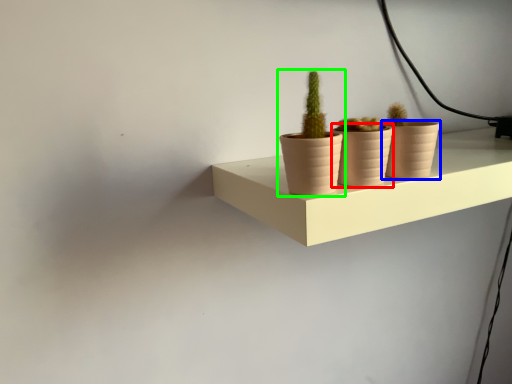
Question: Based on their relative distances, which object is nearer to flowerpot (highlighted by a red box)? Choose from flowerpot (highlighted by a blue box) and houseplant (highlighted by a green box).

Choices:
 (A) flowerpot
 (B) houseplant

Answer: (B)